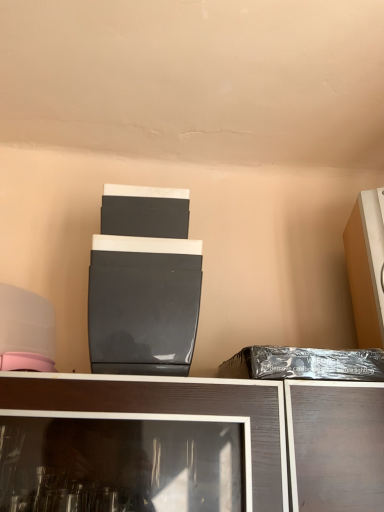
What is the approximate width of matte orange cabinet at right, which ranks as the first appliance in right-to-left order?

It is 9.57 inches.

You are a GUI agent. You are given a task and a screenshot of the screen. Output one action in this format:
    pyautogui.click(x=<x>, y=<y>)
    Task: Click on the matte orange cabinet at right, which ranks as the first appliance in right-to-left order
    The width and height of the screenshot is (384, 512).
    Given the screenshot: What is the action you would take?
    pyautogui.click(x=366, y=268)

Is matte black appliance at center, which is counted as the second appliance, starting from the right, facing away from black plastic bag at right?

No, matte black appliance at center, which is counted as the second appliance, starting from the right,'s orientation is not away from black plastic bag at right.

Does matte black appliance at center, which is counted as the second appliance, starting from the right, have a lesser height compared to black plastic bag at right?

No.

Considering the positions of points (135, 208) and (353, 371), is point (135, 208) farther from camera compared to point (353, 371)?

That is True.

From the image's perspective, which is below, matte black appliance at center, arranged as the 1th appliance when viewed from the left, or black plastic bag at right?

black plastic bag at right appears lower in the image.

In order to click on appliance lying below the matte orange cabinet at right, which ranks as the first appliance in right-to-left order (from the image's perspective) in this screenshot , I will do `click(144, 283)`.

What's the angular difference between matte orange cabinet at right, which ranks as the first appliance in right-to-left order, and matte black appliance at center, which is counted as the second appliance, starting from the right,'s facing directions?

They differ by 11.7 degrees in their facing directions.

Is matte orange cabinet at right, which ranks as the first appliance in right-to-left order, aimed at matte black appliance at center, which is counted as the second appliance, starting from the right?

No.

How much distance is there between matte orange cabinet at right, which ranks as the first appliance in right-to-left order, and matte black appliance at center, which is counted as the second appliance, starting from the right?

The distance of matte orange cabinet at right, which ranks as the first appliance in right-to-left order, from matte black appliance at center, which is counted as the second appliance, starting from the right, is 16.23 inches.

Can you see matte orange cabinet at right, the 2th appliance positioned from the left, touching black plastic bag at right?

No, matte orange cabinet at right, the 2th appliance positioned from the left, is not in contact with black plastic bag at right.

Looking at this image, looking at the image, does matte orange cabinet at right, which ranks as the first appliance in right-to-left order, seem bigger or smaller compared to black plastic bag at right?

matte orange cabinet at right, which ranks as the first appliance in right-to-left order, is bigger than black plastic bag at right.

Would you say matte orange cabinet at right, which ranks as the first appliance in right-to-left order, contains black plastic bag at right?

That's incorrect, black plastic bag at right is not inside matte orange cabinet at right, which ranks as the first appliance in right-to-left order.

Considering the points (365, 199) and (330, 353), which point is in front, point (365, 199) or point (330, 353)?

Positioned in front is point (330, 353).

Considering the sizes of objects black plastic bag at right and matte black appliance at center, which is counted as the second appliance, starting from the right, in the image provided, who is bigger, black plastic bag at right or matte black appliance at center, which is counted as the second appliance, starting from the right,?

matte black appliance at center, which is counted as the second appliance, starting from the right, is bigger.

Is the surface of black plastic bag at right in direct contact with matte black appliance at center, which is counted as the second appliance, starting from the right?

No, black plastic bag at right is not beside matte black appliance at center, which is counted as the second appliance, starting from the right.

Is black plastic bag at right surrounding matte black appliance at center, which is counted as the second appliance, starting from the right?

No.

At what (x,y) coordinates should I click in order to perform the action: click on garbage below the matte black appliance at center, arranged as the 1th appliance when viewed from the left (from the image's perspective). Please return your answer as a coordinate pair (x, y). The image size is (384, 512). Looking at the image, I should click on [305, 364].

From a real-world perspective, is matte black appliance at center, arranged as the 1th appliance when viewed from the left, physically below matte orange cabinet at right, the 2th appliance positioned from the left?

Yes, from a real-world perspective, matte black appliance at center, arranged as the 1th appliance when viewed from the left, is below matte orange cabinet at right, the 2th appliance positioned from the left.

From the image's perspective, is matte black appliance at center, which is counted as the second appliance, starting from the right, below matte orange cabinet at right, which ranks as the first appliance in right-to-left order?

Correct, matte black appliance at center, which is counted as the second appliance, starting from the right, appears lower than matte orange cabinet at right, which ranks as the first appliance in right-to-left order, in the image.

Is matte black appliance at center, which is counted as the second appliance, starting from the right, outside of matte orange cabinet at right, which ranks as the first appliance in right-to-left order?

Yes.

From a real-world perspective, is black plastic bag at right located beneath matte orange cabinet at right, which ranks as the first appliance in right-to-left order?

Yes, from a real-world perspective, black plastic bag at right is under matte orange cabinet at right, which ranks as the first appliance in right-to-left order.

Is black plastic bag at right turned away from matte orange cabinet at right, which ranks as the first appliance in right-to-left order?

black plastic bag at right does not have its back to matte orange cabinet at right, which ranks as the first appliance in right-to-left order.

Based on their positions, is black plastic bag at right located to the left or right of matte orange cabinet at right, which ranks as the first appliance in right-to-left order?

In the image, black plastic bag at right appears on the left side of matte orange cabinet at right, which ranks as the first appliance in right-to-left order.

How different are the orientations of black plastic bag at right and matte orange cabinet at right, which ranks as the first appliance in right-to-left order, in degrees?

black plastic bag at right and matte orange cabinet at right, which ranks as the first appliance in right-to-left order, are facing 14.8 degrees away from each other.

From the image's perspective, count 1st appliances upward from the black plastic bag at right and point to it. Please provide its 2D coordinates.

[(144, 283)]

The image size is (384, 512). What are the coordinates of `appliance to the right of matte black appliance at center, which is counted as the second appliance, starting from the right` in the screenshot? It's located at (366, 268).

Looking at the image, which one is located further to matte orange cabinet at right, which ranks as the first appliance in right-to-left order, black plastic bag at right or matte black appliance at center, which is counted as the second appliance, starting from the right?

matte black appliance at center, which is counted as the second appliance, starting from the right.

Estimate the real-world distances between objects in this image. Which object is further from matte black appliance at center, which is counted as the second appliance, starting from the right, matte orange cabinet at right, which ranks as the first appliance in right-to-left order, or black plastic bag at right?

Among the two, matte orange cabinet at right, which ranks as the first appliance in right-to-left order, is located further to matte black appliance at center, which is counted as the second appliance, starting from the right.

Based on their spatial positions, is black plastic bag at right or matte orange cabinet at right, the 2th appliance positioned from the left, closer to matte black appliance at center, arranged as the 1th appliance when viewed from the left?

black plastic bag at right.

Looking at the image, which one is located closer to black plastic bag at right, matte black appliance at center, arranged as the 1th appliance when viewed from the left, or matte orange cabinet at right, which ranks as the first appliance in right-to-left order?

matte orange cabinet at right, which ranks as the first appliance in right-to-left order.

Considering their positions, is matte orange cabinet at right, which ranks as the first appliance in right-to-left order, positioned closer to black plastic bag at right than matte black appliance at center, which is counted as the second appliance, starting from the right?

matte orange cabinet at right, which ranks as the first appliance in right-to-left order.

Looking at this image, based on their spatial positions, is matte black appliance at center, arranged as the 1th appliance when viewed from the left, or black plastic bag at right closer to matte orange cabinet at right, the 2th appliance positioned from the left?

Based on the image, black plastic bag at right appears to be nearer to matte orange cabinet at right, the 2th appliance positioned from the left.

Locate an element on the screen. This screenshot has height=512, width=384. garbage between matte black appliance at center, which is counted as the second appliance, starting from the right, and matte orange cabinet at right, which ranks as the first appliance in right-to-left order, in the horizontal direction is located at coordinates (305, 364).